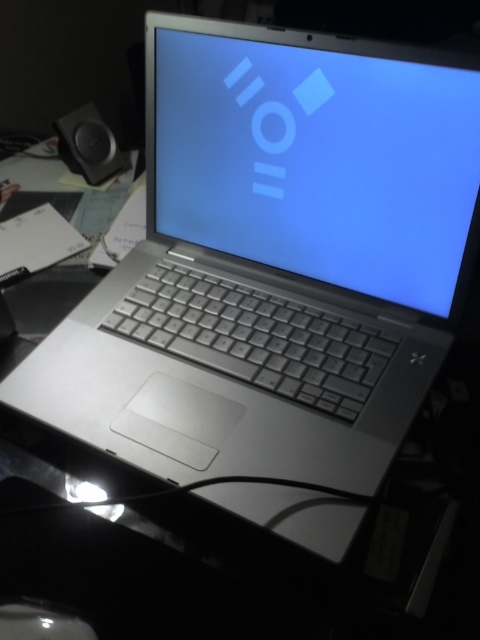
Looking at this image, you are organizing your desk and want to place a new item between the matte plastic screen at center and the black matte speaker at upper left. Considering their sizes, which object should you place closer to the edge of the desk to save space?

The black matte speaker at upper left is smaller in size than the matte plastic screen at center, so placing it closer to the edge of the desk would save more space.

You are trying to reach the black matte speaker at upper left from the matte plastic screen at center. Which direction should you move to get closer to the speaker?

Since the matte plastic screen at center is closer to the viewer than the black matte speaker at upper left, you should move backward to get closer to the black matte speaker at upper left.

From the picture: You are standing in front of a desk with a laptop. There is a point marked at coordinates (456, 198) on the desk. If you want to place a 10 inch ruler horizontally on the desk so that one end is exactly at this point, will the ruler extend beyond the edge of the desk?

The point at (456, 198) is 21.17 inches from the viewer. Since the ruler is 10 inches long, placing it horizontally from this point would leave enough space as the distance from the viewer to the edge of the desk is not specified, but the given distance suggests there is sufficient room. However, without knowing the desk dimensions, we can only confirm the ruler won